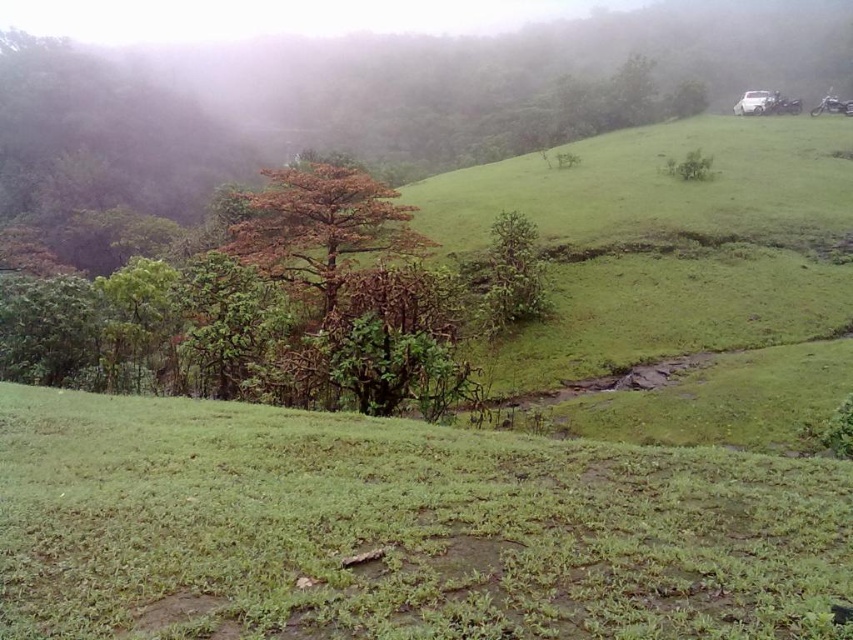
Does point (461, 572) lie in front of point (287, 259)?

Yes.

Who is more distant from viewer, (296, 486) or (245, 211)?

Point (245, 211)

Does point (698, 467) come farther from viewer compared to point (386, 243)?

That is False.

Identify the location of green grassy at lower center. (397, 529).